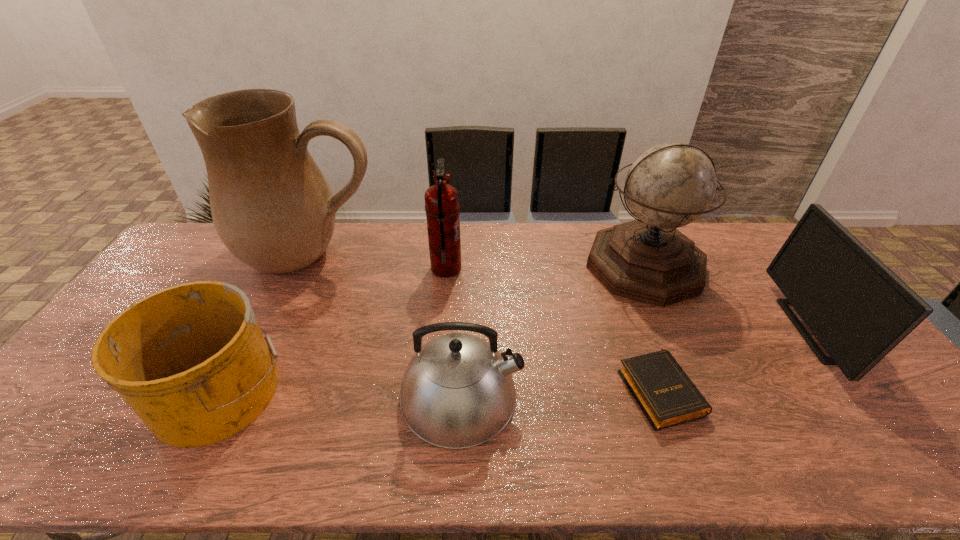
Identify the location of free point located on the screen side of the computer monitor. Image resolution: width=960 pixels, height=540 pixels. (770, 330).

Locate an element on the screen. This screenshot has width=960, height=540. vacant space situated on the screen side of the computer monitor is located at coordinates (778, 330).

Find the location of `free location located 0.080m on the screen side of the computer monitor`. free location located 0.080m on the screen side of the computer monitor is located at coordinates (767, 330).

Locate an element on the screen. free location located 0.050m from the spout of the kettle is located at coordinates (541, 395).

At what (x,y) coordinates should I click in order to perform the action: click on vacant space located on the left of the bucket. Please return your answer as a coordinate pair (x, y). The image size is (960, 540). Looking at the image, I should click on (133, 390).

This screenshot has height=540, width=960. Find the location of `free location located on the back of the Bible`. free location located on the back of the Bible is located at coordinates (636, 327).

Locate an element on the screen. This screenshot has width=960, height=540. cream pitcher located in the far edge section of the desktop is located at coordinates (273, 209).

Locate an element on the screen. globe located at the far edge is located at coordinates (670, 185).

Locate an element on the screen. The height and width of the screenshot is (540, 960). fire extinguisher that is at the far edge is located at coordinates (442, 206).

Find the location of a particular element. kettle at the near edge is located at coordinates (458, 391).